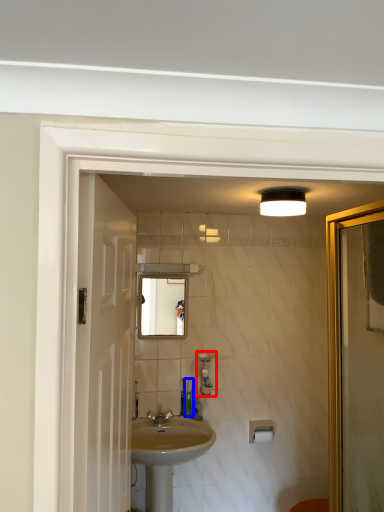
Question: Among these objects, which one is nearest to the camera, soap dispenser (highlighted by a red box) or toiletry (highlighted by a blue box)?

Choices:
 (A) soap dispenser
 (B) toiletry

Answer: (A)